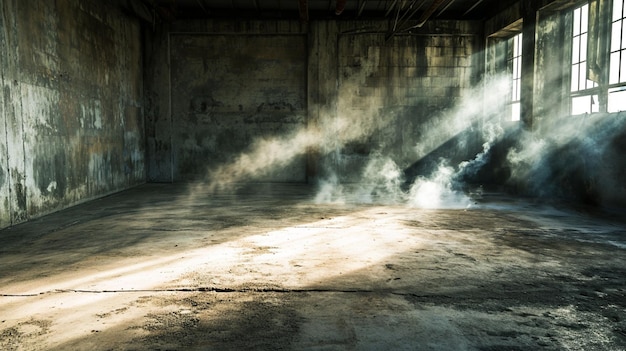
Locate an element on the screen. light is located at coordinates (334, 248).